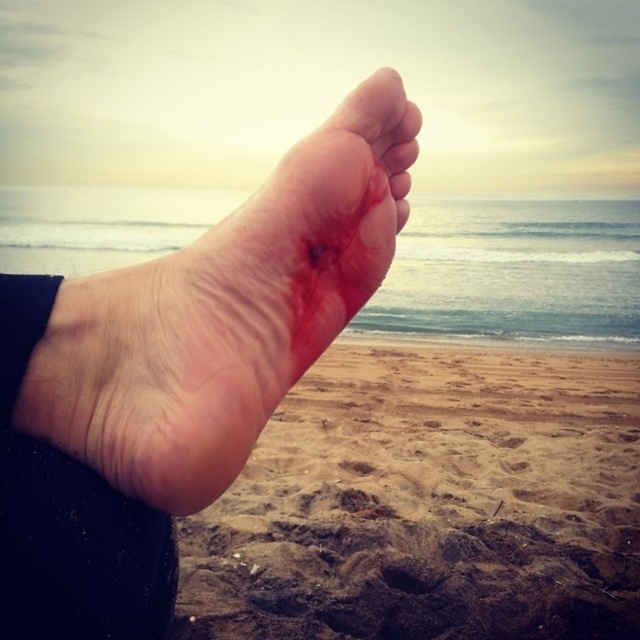
Consider the image. You are a dermatologist examining a patient. You notice two areas labeled as dry skin foot at center and dry skin at center. Which one is higher?

The dry skin foot at center is taller than dry skin at center.